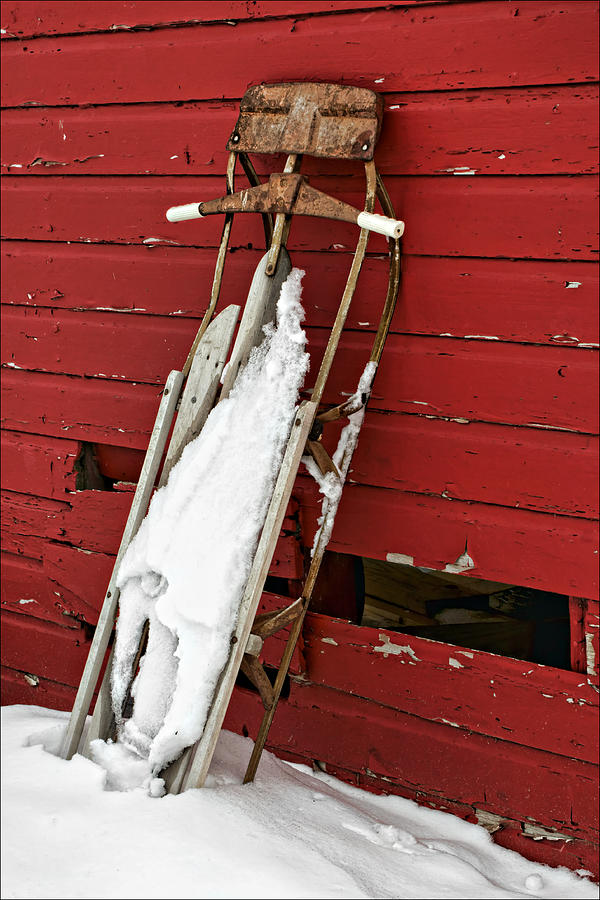
Where is `handles`? The width and height of the screenshot is (600, 900). handles is located at coordinates (375, 223), (190, 208).